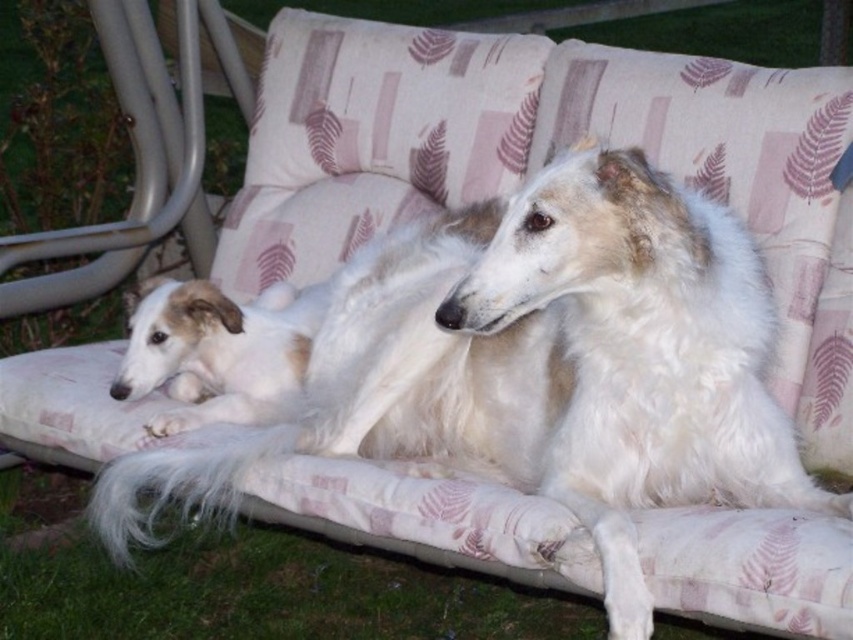
You are a photographer trying to capture a clear shot of both the white fluffy dog at center and the light brown fur at center. Which one would appear larger in your photo?

The white fluffy dog at center would appear larger in the photo because it is closer to the viewer than the light brown fur at center.

Where is the white fluffy dog at center located in the image?

The white fluffy dog at center is located at point 0.572 in the x coordinate and 0.631 in the y coordinate.